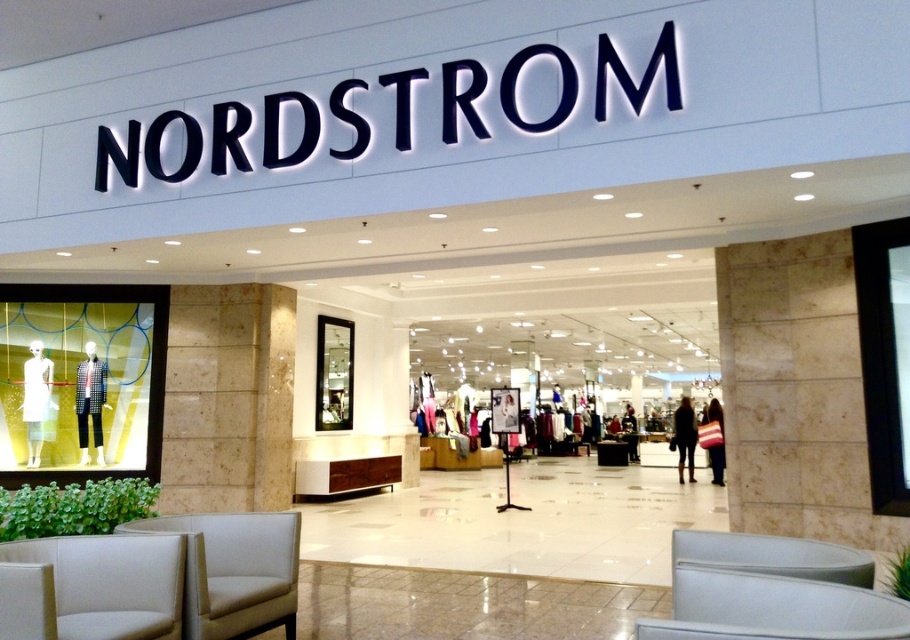
You are standing at the entrance of the Nordstrom store and want to determine the relative positions of two points marked in the image. Which point, point (231,532) or point (685,400), is closer to you?

Point (231,532) is closer to the viewer than point (685,400).

You are a customer entering the Nordstrom store and see both the white fabric armchair at lower left and the white leather armchair at lower left. Which one is positioned higher from the ground?

The white fabric armchair at lower left is located above the white leather armchair at lower left, so the white fabric armchair at lower left is positioned higher from the ground.